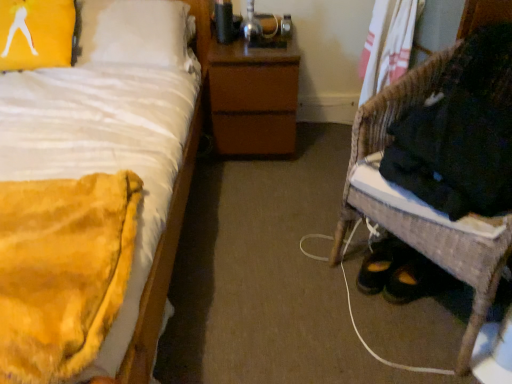
Question: From the image's perspective, would you say woven wicker chair at lower right is shown under yellow fabric pillow at upper left?

Choices:
 (A) yes
 (B) no

Answer: (A)

Question: Is woven wicker chair at lower right at the right side of yellow fabric pillow at upper left?

Choices:
 (A) no
 (B) yes

Answer: (B)

Question: Considering the relative sizes of woven wicker chair at lower right and yellow fabric pillow at upper left in the image provided, is woven wicker chair at lower right smaller than yellow fabric pillow at upper left?

Choices:
 (A) yes
 (B) no

Answer: (B)

Question: Is woven wicker chair at lower right to the left of yellow fabric pillow at upper left from the viewer's perspective?

Choices:
 (A) yes
 (B) no

Answer: (B)

Question: Is woven wicker chair at lower right closer to the viewer compared to yellow fabric pillow at upper left?

Choices:
 (A) yes
 (B) no

Answer: (A)

Question: Can you confirm if woven wicker chair at lower right is taller than yellow fabric pillow at upper left?

Choices:
 (A) yes
 (B) no

Answer: (A)

Question: Is brown matte nightstand at center at the left side of yellow plush blanket at left?

Choices:
 (A) yes
 (B) no

Answer: (B)

Question: Is brown matte nightstand at center taller than yellow plush blanket at left?

Choices:
 (A) no
 (B) yes

Answer: (A)

Question: Is brown matte nightstand at center located outside yellow plush blanket at left?

Choices:
 (A) no
 (B) yes

Answer: (B)

Question: Is brown matte nightstand at center shorter than yellow plush blanket at left?

Choices:
 (A) no
 (B) yes

Answer: (B)

Question: Does brown matte nightstand at center turn towards yellow plush blanket at left?

Choices:
 (A) no
 (B) yes

Answer: (A)

Question: Considering the relative sizes of brown matte nightstand at center and yellow plush blanket at left in the image provided, is brown matte nightstand at center smaller than yellow plush blanket at left?

Choices:
 (A) yes
 (B) no

Answer: (A)

Question: Is brown matte nightstand at center oriented towards woven wicker chair at lower right?

Choices:
 (A) yes
 (B) no

Answer: (B)